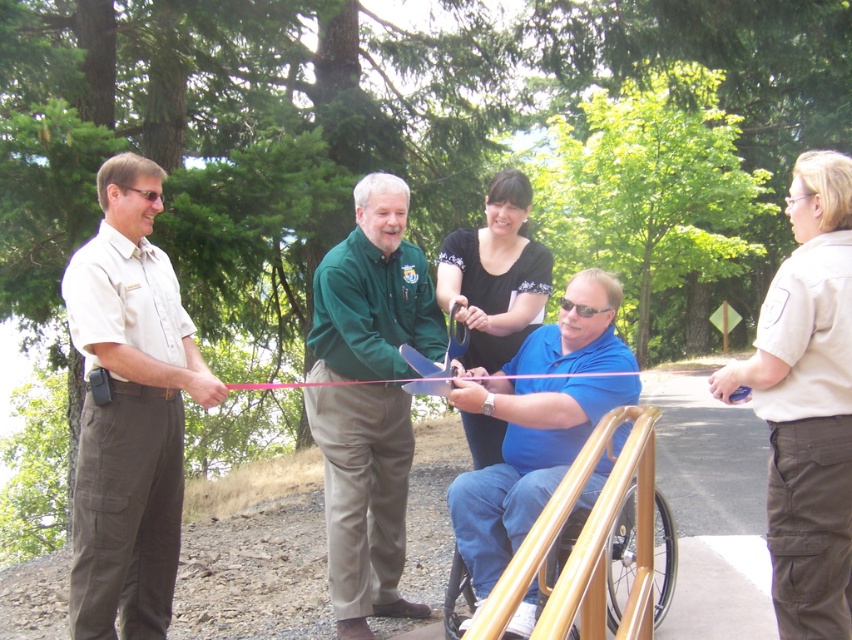
You are a photographer at the ribbon cutting ceremony. You want to take a photo that includes both the khaki uniform pants at left and the wooden textured wheelchair at lower center. Which object should you focus on first to ensure both are in frame?

The khaki uniform pants at left is smaller than the wooden textured wheelchair at lower center, so you should focus on the wooden textured wheelchair at lower center first to ensure both fit in the frame.

You are a photographer at the ribbon cutting ceremony. You need to take a photo that includes both the green matte shirt at center and the tan uniform at right. Which one should be placed lower in the photo to ensure both are visible?

The green matte shirt at center is positioned under the tan uniform at right, so to ensure both are visible in the photo, the green matte shirt at center should be placed lower in the photo.

You are standing at the center of the image and want to hand a document to the person wearing the khaki uniform pants at left. In which direction should you move to approach them?

The khaki uniform pants at left is located at point 0.644 on the x and 0.153 on the y coordinate, so you should move to the left and slightly forward to reach them.